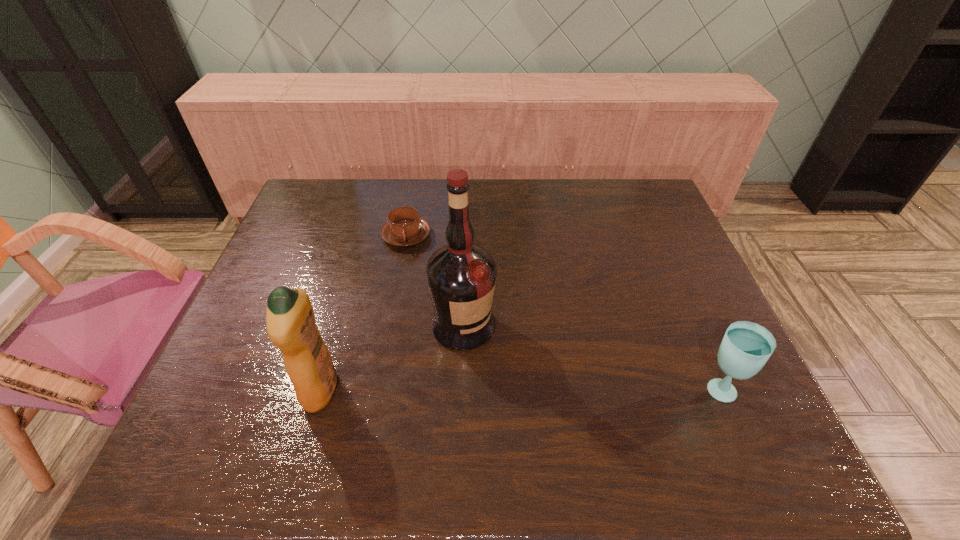
Identify the location of glass that is at the near edge. (746, 346).

I want to click on object at the right edge, so click(x=746, y=346).

The width and height of the screenshot is (960, 540). Find the location of `object at the near right corner`. object at the near right corner is located at coordinates (746, 346).

Find the location of `vacant space at the far edge`. vacant space at the far edge is located at coordinates (372, 186).

In the image, there is a desktop. At what (x,y) coordinates should I click in order to perform the action: click on vacant space at the left edge. Please return your answer as a coordinate pair (x, y). This screenshot has width=960, height=540. Looking at the image, I should click on (292, 270).

At what (x,y) coordinates should I click in order to perform the action: click on free spot at the right edge of the desktop. Please return your answer as a coordinate pair (x, y). This screenshot has height=540, width=960. Looking at the image, I should click on (652, 251).

Find the location of a particular element. The image size is (960, 540). vacant space at the far left corner of the desktop is located at coordinates (329, 194).

Image resolution: width=960 pixels, height=540 pixels. In the image, there is a desktop. What are the coordinates of `vacant space at the far right corner` in the screenshot? It's located at (622, 187).

I want to click on free space between the leftmost object and the liquor, so click(x=393, y=357).

Identify the location of free spot between the rightmost object and the third shortest object. This screenshot has width=960, height=540. (519, 389).